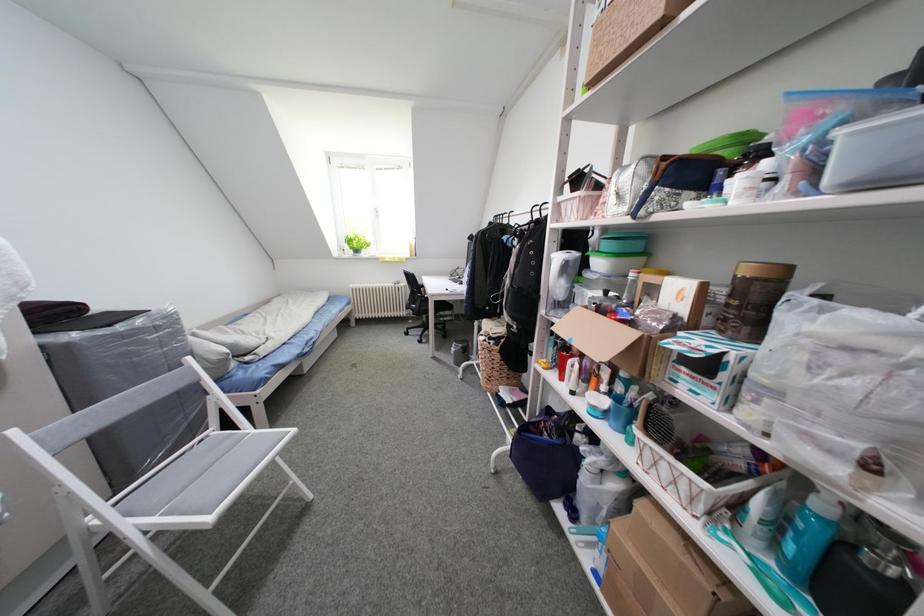
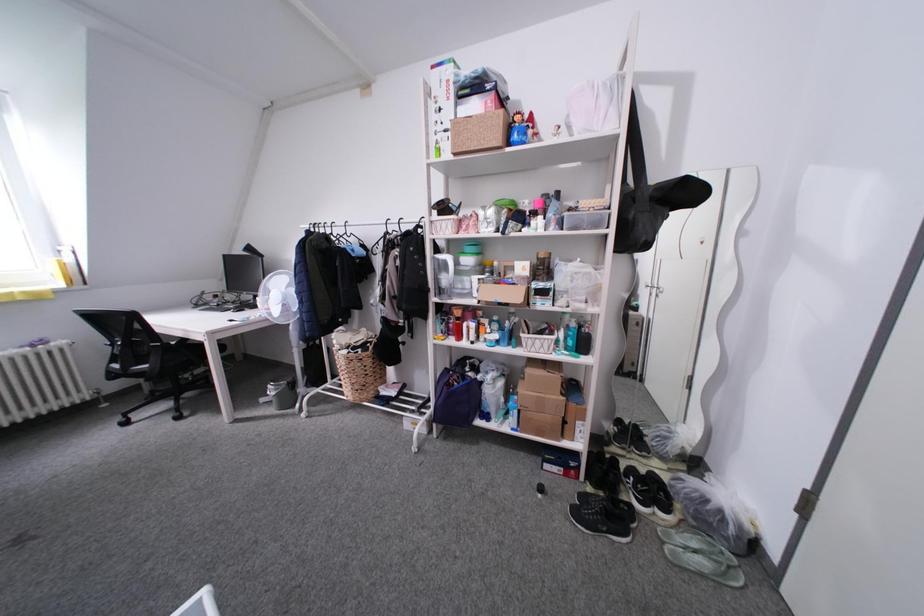
Question: How did the camera likely rotate?

Choices:
 (A) Left
 (B) Right
 (C) Up
 (D) Down

Answer: (B)